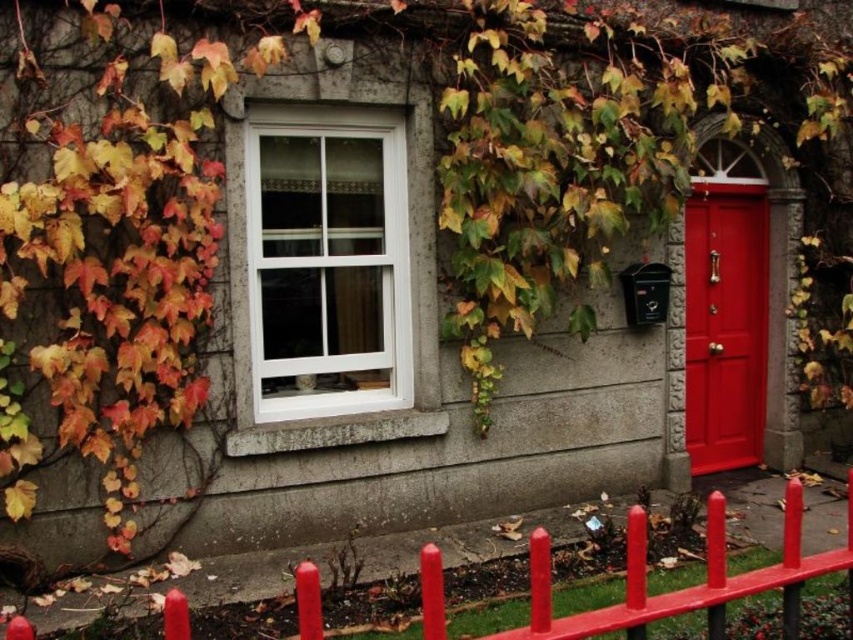
Question: Which of these objects is positioned closest to the smooth glossy fence at lower center?

Choices:
 (A) glossy wood door at right
 (B) white plastic window at center

Answer: (B)

Question: Which is farther from the smooth glossy fence at lower center?

Choices:
 (A) glossy wood door at right
 (B) white plastic window at center

Answer: (A)

Question: Can you confirm if white plastic window at center is positioned above glossy wood door at right?

Choices:
 (A) no
 (B) yes

Answer: (B)

Question: Where is smooth glossy fence at lower center located in relation to glossy wood door at right in the image?

Choices:
 (A) above
 (B) below

Answer: (B)

Question: Does white plastic window at center appear over glossy wood door at right?

Choices:
 (A) yes
 (B) no

Answer: (A)

Question: Among these points, which one is farthest from the camera?

Choices:
 (A) (380, 406)
 (B) (630, 588)
 (C) (704, 273)

Answer: (C)